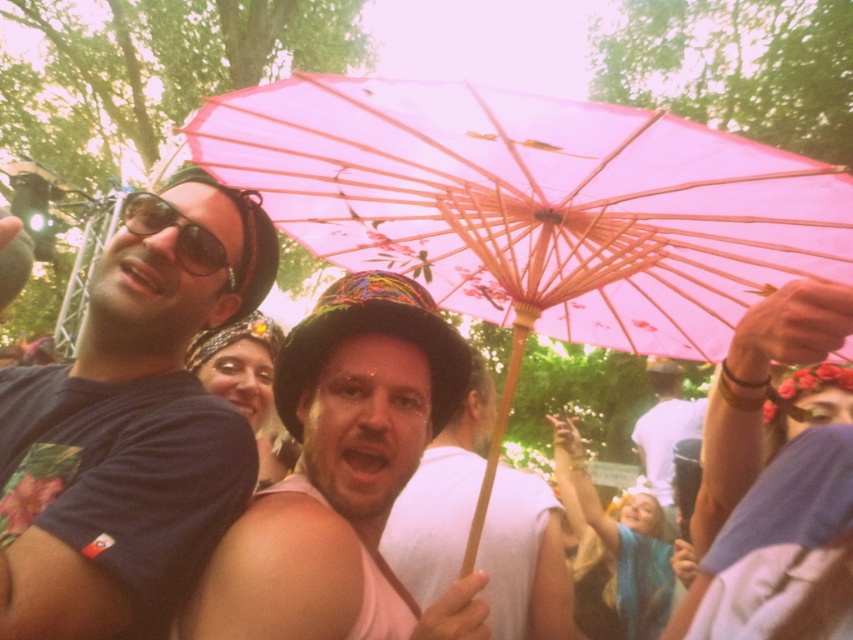
Is the position of matte black hat at center more distant than that of matte black goggles at upper left?

No, it is not.

Between point (426, 317) and point (148, 228), which one is positioned behind?

The point (426, 317) is behind.

This screenshot has width=853, height=640. What are the coordinates of `matte black hat at center` in the screenshot? It's located at (343, 472).

From the picture: Can you confirm if pink paper umbrella at center is positioned below matte black goggles at upper left?

Indeed, pink paper umbrella at center is positioned under matte black goggles at upper left.

Does pink paper umbrella at center have a greater width compared to matte black goggles at upper left?

Yes, pink paper umbrella at center is wider than matte black goggles at upper left.

Identify the location of pink paper umbrella at center. This screenshot has height=640, width=853. (534, 204).

Locate an element on the screen. The width and height of the screenshot is (853, 640). pink paper umbrella at center is located at coordinates (534, 204).

Between pink paper umbrella at center and white matte shirt at center, which one appears on the right side from the viewer's perspective?

Positioned to the right is white matte shirt at center.

Find the location of a particular element. Image resolution: width=853 pixels, height=640 pixels. pink paper umbrella at center is located at coordinates (534, 204).